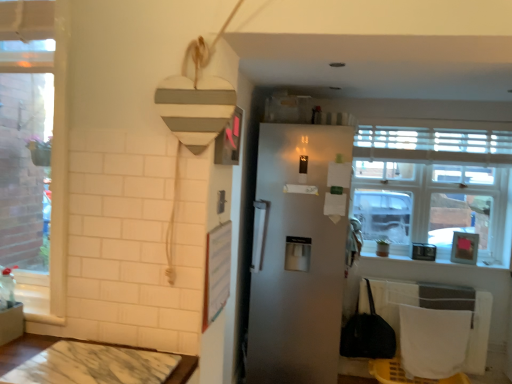
Question: Is clear glass window at upper right at the left side of marble table at lower left?

Choices:
 (A) no
 (B) yes

Answer: (A)

Question: Is clear glass window at upper right positioned behind marble table at lower left?

Choices:
 (A) yes
 (B) no

Answer: (A)

Question: Is clear glass window at upper right shorter than marble table at lower left?

Choices:
 (A) no
 (B) yes

Answer: (A)

Question: Considering the relative sizes of clear glass window at upper right and marble table at lower left in the image provided, is clear glass window at upper right wider than marble table at lower left?

Choices:
 (A) yes
 (B) no

Answer: (B)

Question: Is clear glass window at upper right bigger than marble table at lower left?

Choices:
 (A) no
 (B) yes

Answer: (B)

Question: Is marble table at lower left taller or shorter than satin white fridge at center?

Choices:
 (A) short
 (B) tall

Answer: (A)

Question: Is marble table at lower left bigger or smaller than satin white fridge at center?

Choices:
 (A) small
 (B) big

Answer: (A)

Question: Considering the positions of point (50, 372) and point (263, 276), is point (50, 372) closer or farther from the camera than point (263, 276)?

Choices:
 (A) closer
 (B) farther

Answer: (A)

Question: Considering the positions of marble table at lower left and satin white fridge at center in the image, is marble table at lower left wider or thinner than satin white fridge at center?

Choices:
 (A) thin
 (B) wide

Answer: (A)

Question: Considering the positions of point (245, 380) and point (185, 375), is point (245, 380) closer or farther from the camera than point (185, 375)?

Choices:
 (A) farther
 (B) closer

Answer: (A)

Question: Do you think satin white fridge at center is within marble table at lower left, or outside of it?

Choices:
 (A) outside
 (B) inside

Answer: (A)

Question: From a real-world perspective, is satin white fridge at center physically located above or below marble table at lower left?

Choices:
 (A) above
 (B) below

Answer: (A)

Question: Considering the positions of satin white fridge at center and marble table at lower left in the image, is satin white fridge at center wider or thinner than marble table at lower left?

Choices:
 (A) wide
 (B) thin

Answer: (A)

Question: From the image's perspective, relative to marble table at lower left, is clear glass window at upper right above or below?

Choices:
 (A) below
 (B) above

Answer: (B)

Question: From a real-world perspective, is clear glass window at upper right physically located above or below marble table at lower left?

Choices:
 (A) below
 (B) above

Answer: (B)